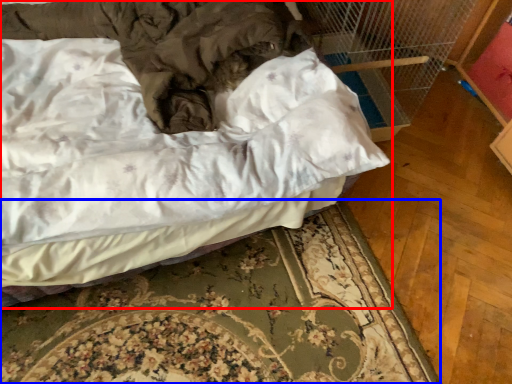
Question: Which of the following is the farthest to the observer, bed (highlighted by a red box) or bed frame (highlighted by a blue box)?

Choices:
 (A) bed
 (B) bed frame

Answer: (B)